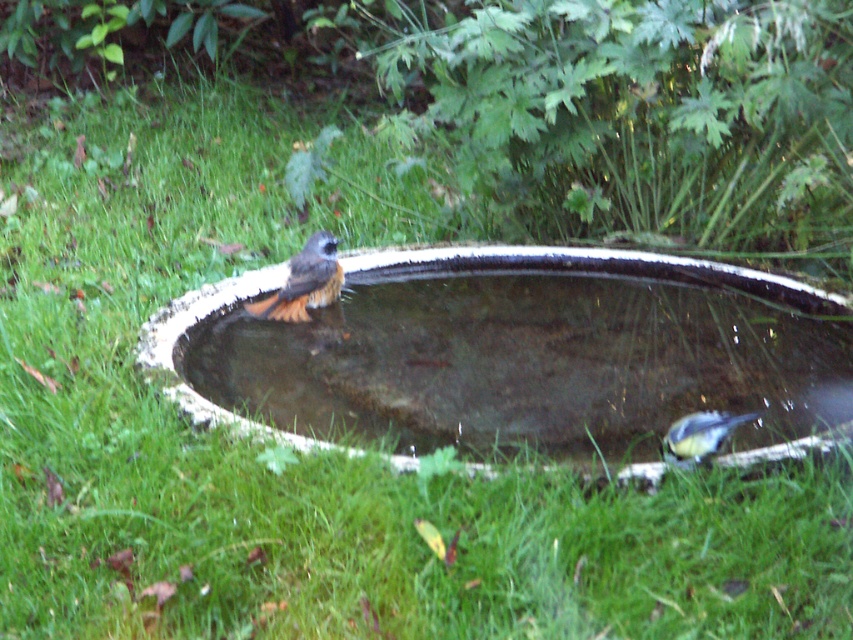
You are standing near the bird bath and want to observe both birds. Which bird is closer to you, the one at point (345, 400) or the one at point (329, 278)?

The bird at point (345, 400) is closer to you because it is in front of the bird at point (329, 278).

You are a bird watcher observing the birds in the bird bath. You notice a point marked at coordinates (305, 282). What is located at this point?

The point at coordinates (305, 282) marks the location of brown speckled feathers at center.